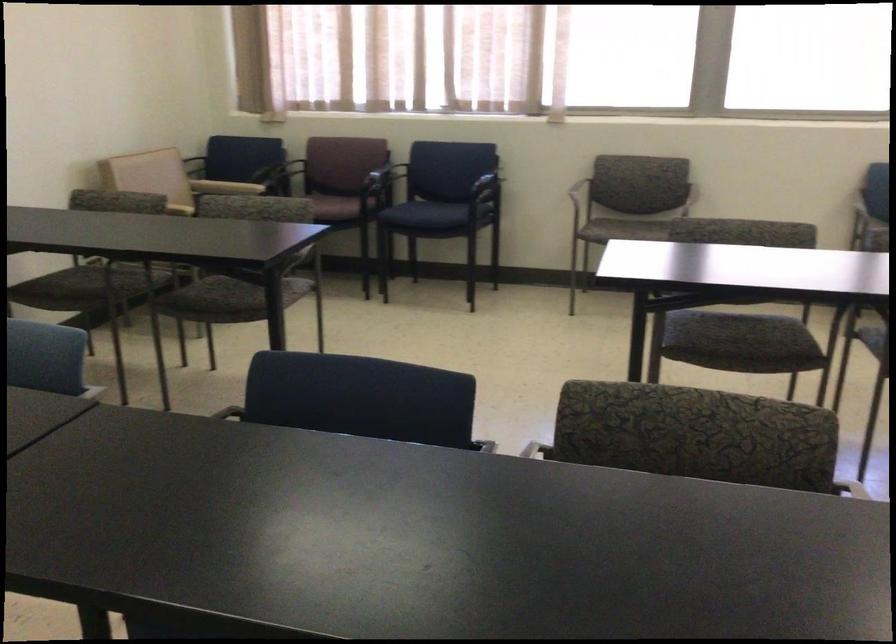
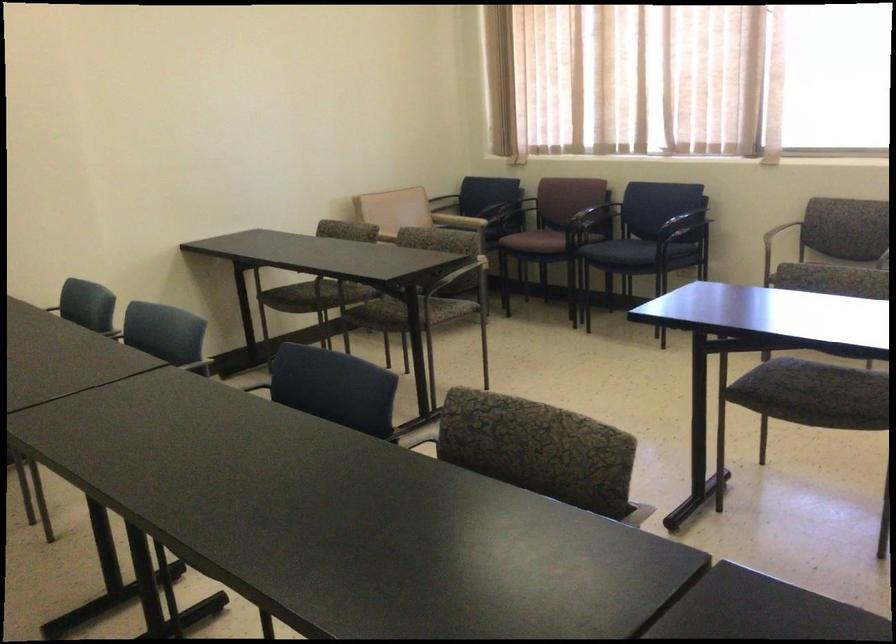
Where in the second image is the point corresponding to point (140, 176) from the first image?

(381, 205)